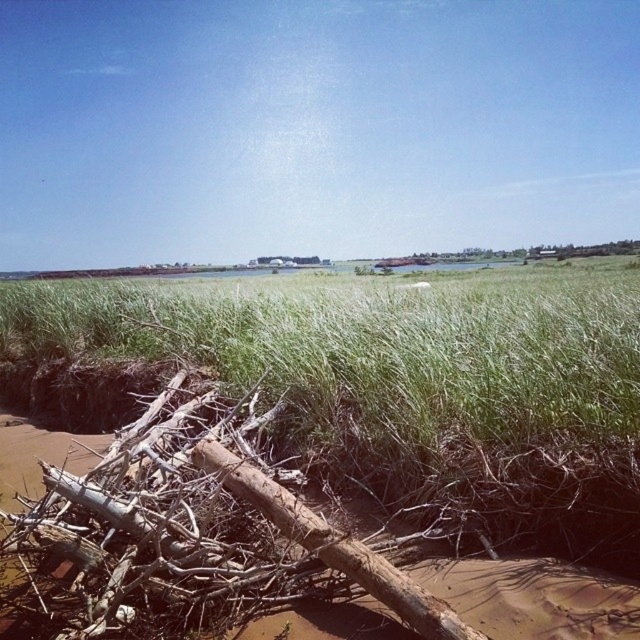
You are standing at the edge of the grassland and want to reach the water. You see the green rough grass at center and the brown rough wood at lower left. Which object is closer to you as you head towards the water?

The green rough grass at center is closer to you because the brown rough wood at lower left is behind it, meaning the grass is in front and nearer to your current position.

You are standing at the edge of the grassland looking towards the water. You notice two points marked in the scene. Which point, point (369, 474) or point (113, 589), is closer to your current position?

Point (369, 474) is closer to your current position because it is further to the viewer compared to point (113, 589).